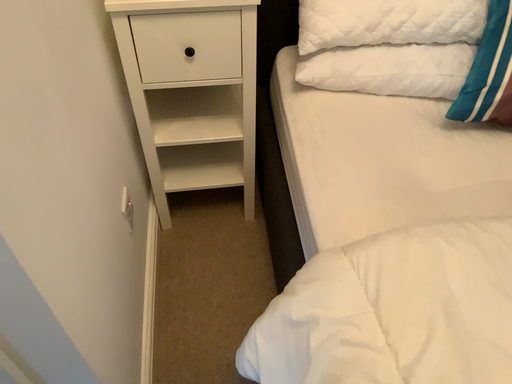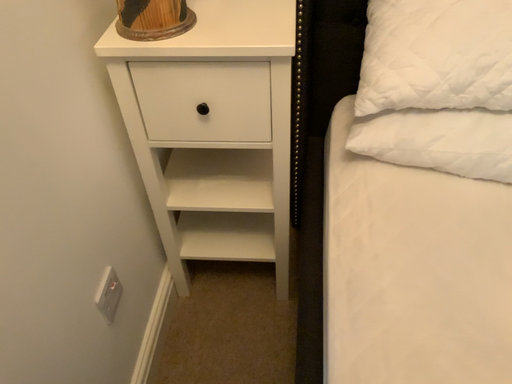
Question: Which way did the camera rotate in the video?

Choices:
 (A) rotated right
 (B) rotated left

Answer: (B)